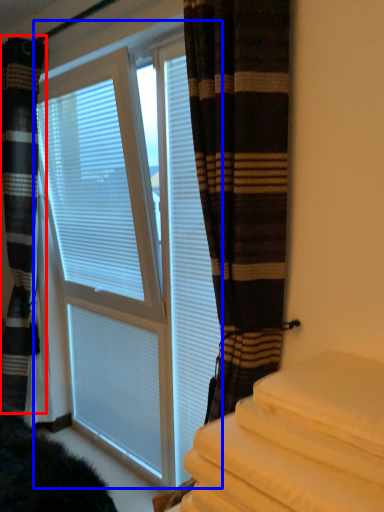
Question: Which object appears farthest to the camera in this image, curtain (highlighted by a red box) or bay window (highlighted by a blue box)?

Choices:
 (A) curtain
 (B) bay window

Answer: (A)